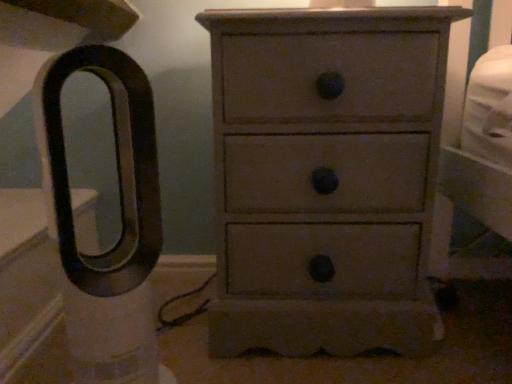
Question: Which direction should I rotate to look at light brown wood chest of drawers at center?

Choices:
 (A) right
 (B) left

Answer: (A)